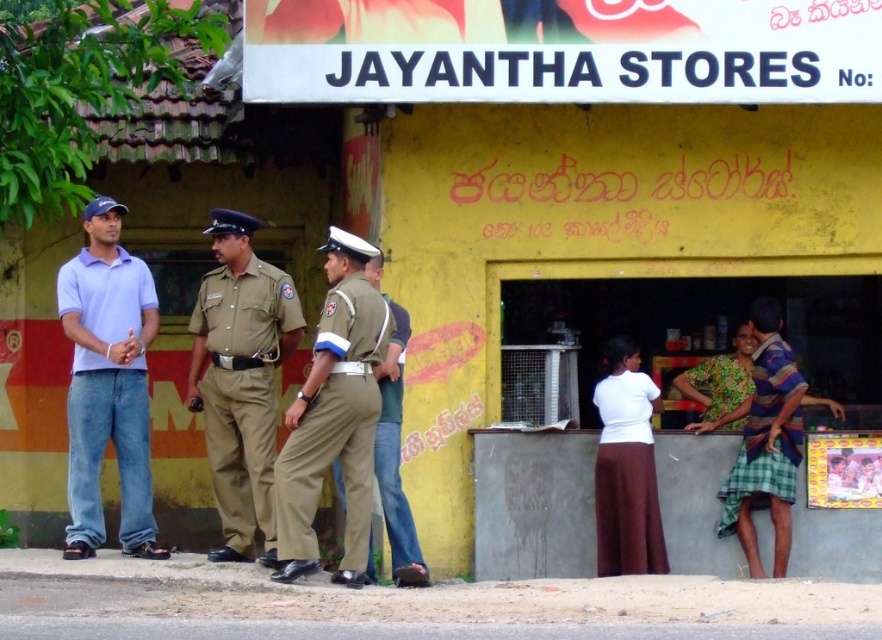
Question: Considering the real-world distances, which object is closest to the floral fabric dress at lower right?

Choices:
 (A) khaki fabric pants at center
 (B) striped fabric dress at right
 (C) light blue cotton shirt at left
 (D) khaki fabric uniform at center

Answer: (B)

Question: Is tan uniform at center in front of khaki fabric pants at center?

Choices:
 (A) no
 (B) yes

Answer: (A)

Question: Which object is the closest to the khaki fabric pants at center?

Choices:
 (A) tan uniform at center
 (B) floral fabric dress at lower right

Answer: (A)

Question: Is the position of light blue cotton shirt at left less distant than that of floral fabric dress at lower right?

Choices:
 (A) yes
 (B) no

Answer: (A)

Question: Estimate the real-world distances between objects in this image. Which object is farther from the khaki fabric pants at center?

Choices:
 (A) tan uniform at center
 (B) striped fabric dress at right
 (C) light blue cotton shirt at left
 (D) floral fabric dress at lower right

Answer: (D)

Question: Is khaki fabric pants at center above floral fabric dress at lower right?

Choices:
 (A) no
 (B) yes

Answer: (A)